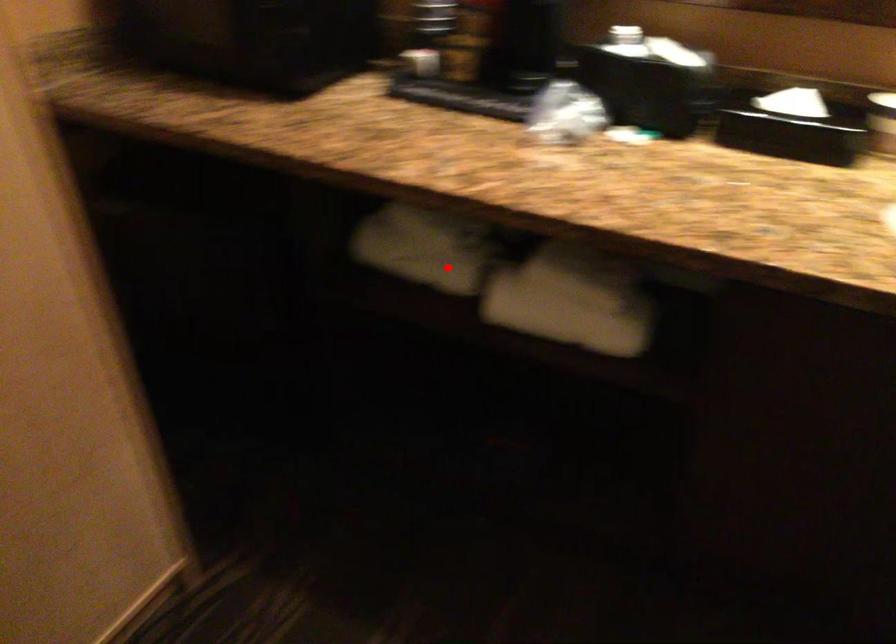
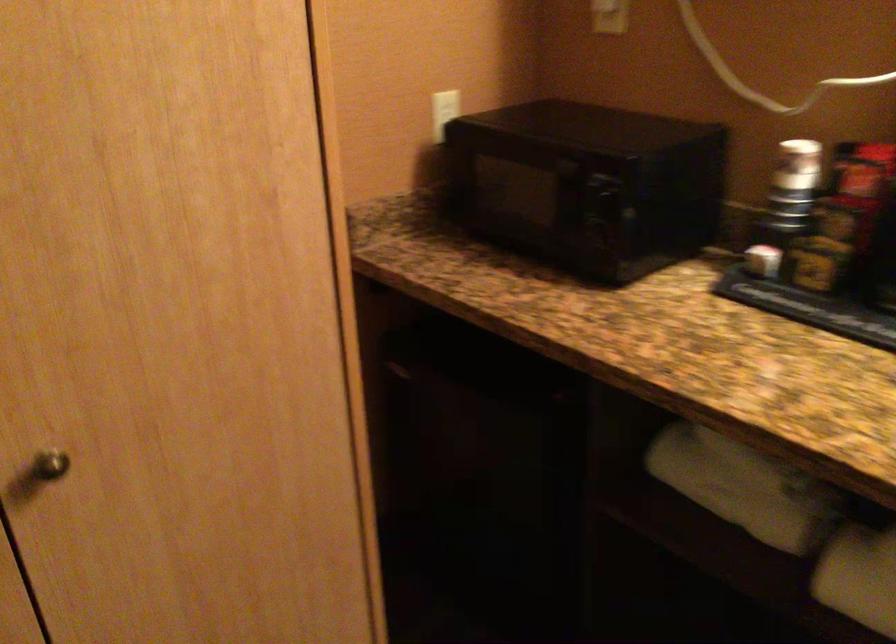
The point at the highlighted location is marked in the first image. Where is the corresponding point in the second image?

(764, 509)